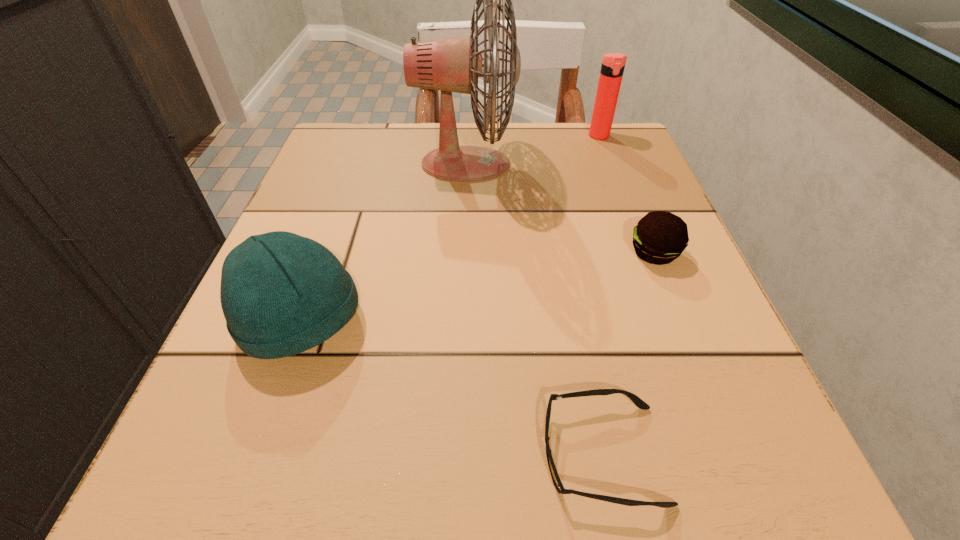
The image size is (960, 540). Identify the location of free spot located 0.140m on the front of the beanie. (241, 493).

At what (x,y) coordinates should I click in order to perform the action: click on vacant position located on the left of the patty. Please return your answer as a coordinate pair (x, y). Looking at the image, I should click on (405, 253).

This screenshot has height=540, width=960. I want to click on blank space located on the front-facing side of the nearest object, so click(x=242, y=454).

You are a GUI agent. You are given a task and a screenshot of the screen. Output one action in this format:
    pyautogui.click(x=<x>, y=<y>)
    Task: Click on the vacant space located 0.160m on the front-facing side of the nearest object
    The image size is (960, 540).
    Given the screenshot: What is the action you would take?
    pyautogui.click(x=397, y=454)

Where is `vacant area situated 0.060m on the front-facing side of the nearest object`? Image resolution: width=960 pixels, height=540 pixels. vacant area situated 0.060m on the front-facing side of the nearest object is located at coordinates (488, 454).

Locate an element on the screen. The width and height of the screenshot is (960, 540). fan at the far edge is located at coordinates (454, 64).

At what (x,y) coordinates should I click in order to perform the action: click on thermos bottle that is at the far edge. Please return your answer as a coordinate pair (x, y). Looking at the image, I should click on (613, 64).

Identify the location of object that is at the near edge. This screenshot has height=540, width=960. (635, 399).

At what (x,y) coordinates should I click in order to perform the action: click on object located in the left edge section of the desktop. Please return your answer as a coordinate pair (x, y). Looking at the image, I should click on (281, 294).

Identify the location of thermos bottle that is at the right edge. Image resolution: width=960 pixels, height=540 pixels. (613, 64).